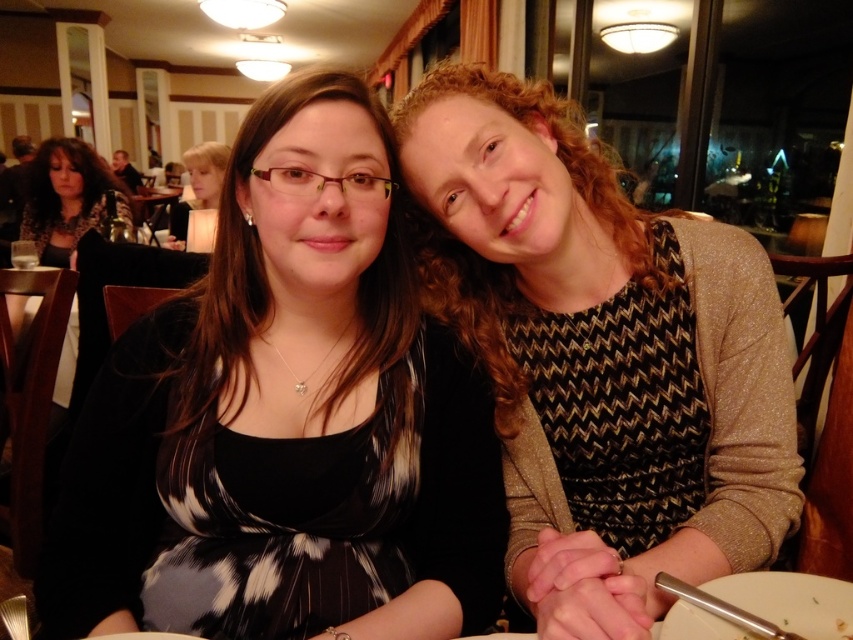
Question: Which of the following is the farthest from the observer?

Choices:
 (A) sparkly gold sweater at right
 (B) matte black dress at left

Answer: (B)

Question: Can you confirm if white ceramic plate at lower right is thinner than matte black dress at left?

Choices:
 (A) no
 (B) yes

Answer: (B)

Question: Does black printed dress at center have a smaller size compared to white ceramic plate at lower right?

Choices:
 (A) yes
 (B) no

Answer: (B)

Question: Which point appears farthest from the camera in this image?

Choices:
 (A) (677, 429)
 (B) (51, 230)

Answer: (B)

Question: In this image, where is white ceramic plate at lower right located relative to matte black dress at left?

Choices:
 (A) above
 (B) below

Answer: (B)

Question: Which of the following is the farthest from the observer?

Choices:
 (A) tap(68, 211)
 (B) tap(795, 602)
 (C) tap(453, 216)

Answer: (A)